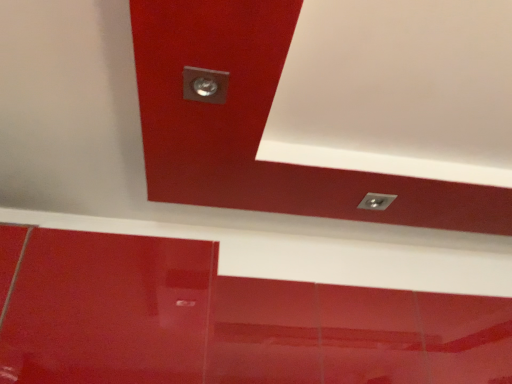
Question: Is metallic silver light fixture at upper right taller or shorter than metallic silver exhaust hood at upper left?

Choices:
 (A) short
 (B) tall

Answer: (A)

Question: From a real-world perspective, is metallic silver light fixture at upper right physically located above or below metallic silver exhaust hood at upper left?

Choices:
 (A) below
 (B) above

Answer: (A)

Question: From the image's perspective, is metallic silver light fixture at upper right located above or below metallic silver exhaust hood at upper left?

Choices:
 (A) above
 (B) below

Answer: (B)

Question: Does point (350, 16) appear closer or farther from the camera than point (368, 203)?

Choices:
 (A) closer
 (B) farther

Answer: (A)

Question: Is metallic silver exhaust hood at upper left inside or outside of metallic silver light fixture at upper right?

Choices:
 (A) outside
 (B) inside

Answer: (A)

Question: In terms of height, does metallic silver exhaust hood at upper left look taller or shorter compared to metallic silver light fixture at upper right?

Choices:
 (A) short
 (B) tall

Answer: (B)

Question: From the image's perspective, is metallic silver exhaust hood at upper left above or below metallic silver light fixture at upper right?

Choices:
 (A) below
 (B) above

Answer: (B)